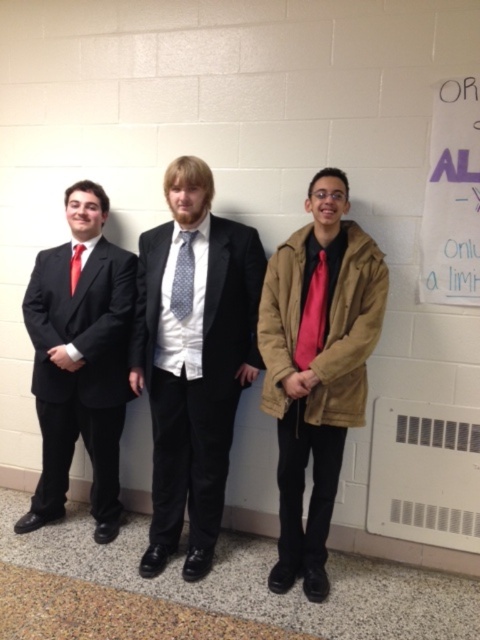
You are a tailor measuring for alterations. You need to determine which item, the matte black suit at left or the matte red tie at left, requires more fabric for adjustments. Based on their sizes, which one would need more fabric?

The matte black suit at left is larger in size than the matte red tie at left, so it would require more fabric for adjustments.

You are a photographer setting up for a group photo. You need to ensure that all items mentioned are visible in the frame. Given that the tan suede jacket at center and the red satin tie at center are both at the center, which item might you need to adjust the camera angle to better highlight due to its size?

The tan suede jacket at center is larger than the red satin tie at center, so you might need to adjust the camera angle to better highlight the tan suede jacket at center to ensure it is fully visible in the frame.

You are standing in front of the three individuals. You need to hand a document to the person wearing the polished black suit at center and the tan suede jacket at center. Which one should you approach first if you want to give the document to the person on the left side?

The polished black suit at center is positioned on the left side of the tan suede jacket at center, so you should approach the polished black suit at center first.